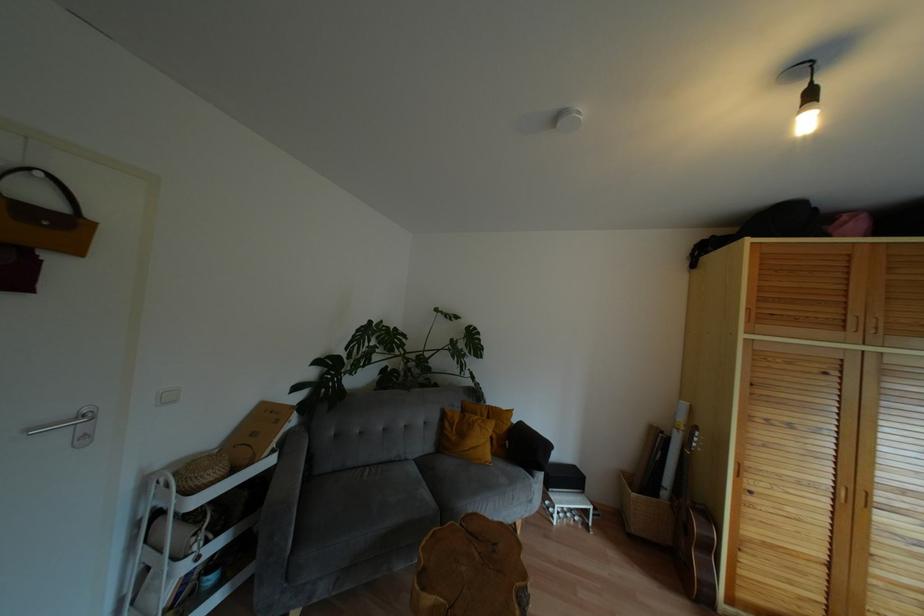
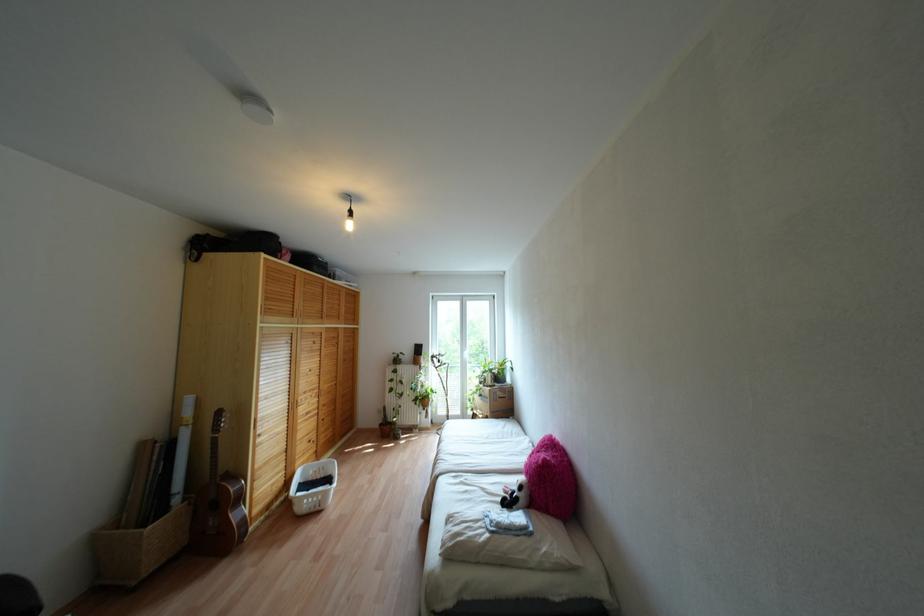
Locate, in the second image, the point that corresponds to [710,548] in the first image.

(238, 498)